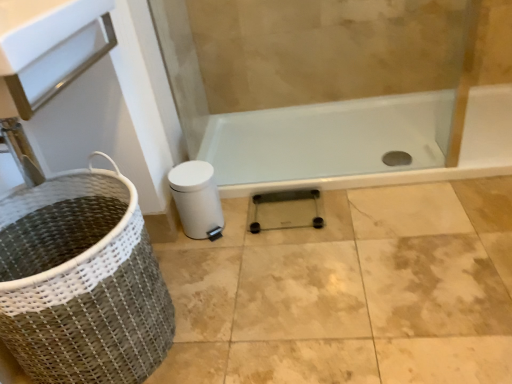
Where is `free region on the left part of transparent glass scale at center`? The height and width of the screenshot is (384, 512). free region on the left part of transparent glass scale at center is located at coordinates (229, 249).